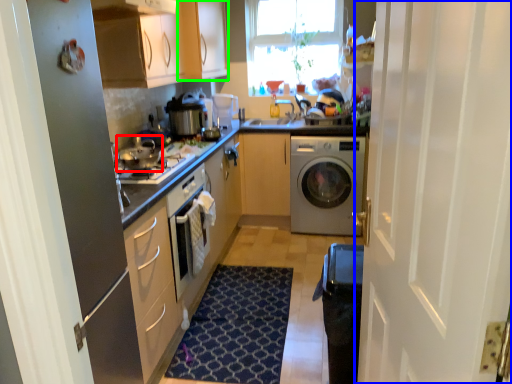
Question: Considering the real-world distances, which object is closest to appliance (highlighted by a red box)? door (highlighted by a blue box) or cabinetry (highlighted by a green box).

Choices:
 (A) door
 (B) cabinetry

Answer: (B)